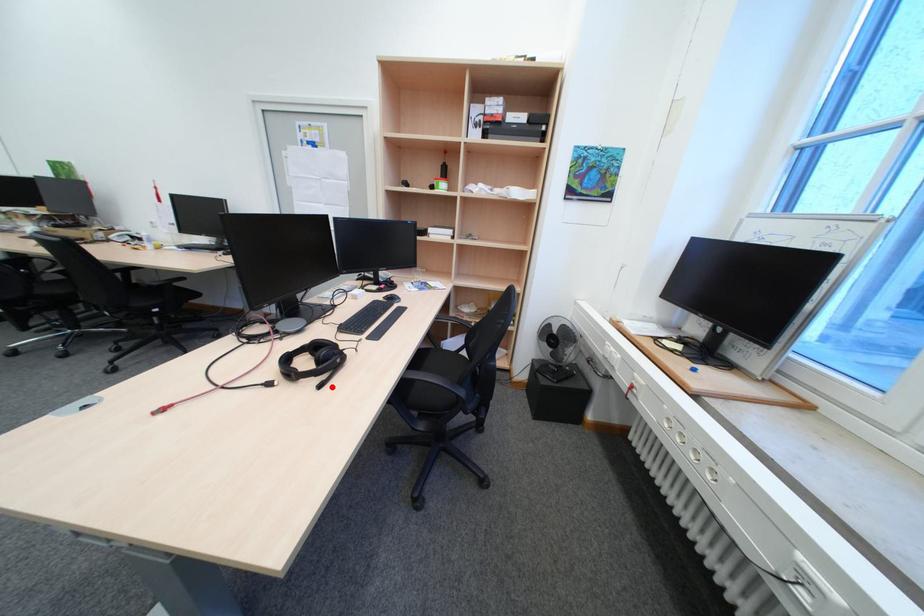
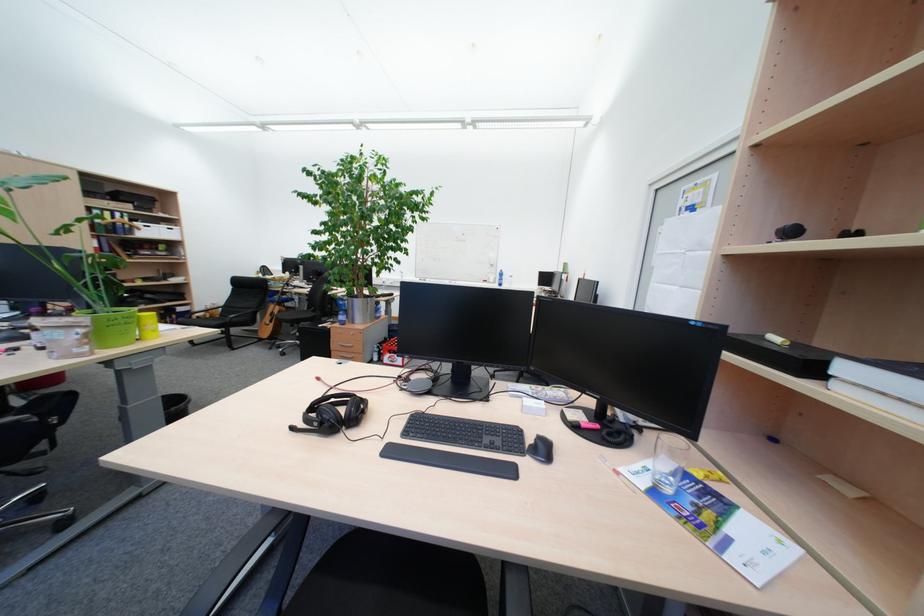
Locate, in the second image, the point that corresponds to the highlighted location in the first image.

(304, 430)